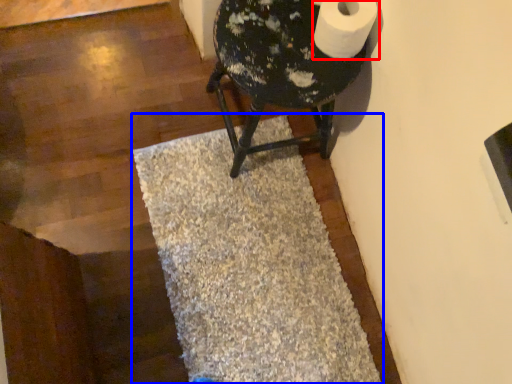
Question: Which point is further to the camera, toilet paper (highlighted by a red box) or bath mat (highlighted by a blue box)?

Choices:
 (A) toilet paper
 (B) bath mat

Answer: (B)